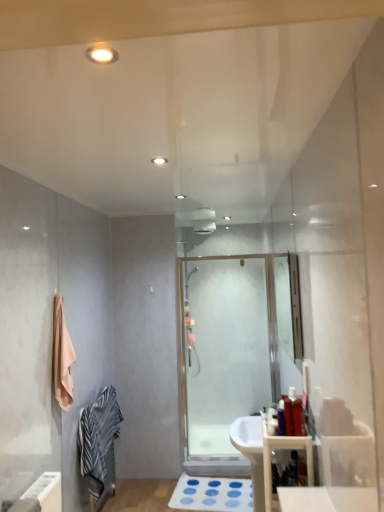
Question: Considering the relative sizes of matte plastic toothbrush at center, arranged as the first toiletry when viewed from the left, and transparent glass shower door at center in the image provided, is matte plastic toothbrush at center, arranged as the first toiletry when viewed from the left, smaller than transparent glass shower door at center?

Choices:
 (A) yes
 (B) no

Answer: (A)

Question: Is transparent glass shower door at center surrounded by matte plastic toothbrush at center, the second toiletry in the right-to-left sequence?

Choices:
 (A) no
 (B) yes

Answer: (A)

Question: Is matte plastic toothbrush at center, arranged as the first toiletry when viewed from the left, placed right next to transparent glass shower door at center?

Choices:
 (A) yes
 (B) no

Answer: (B)

Question: Can we say matte plastic toothbrush at center, arranged as the first toiletry when viewed from the left, lies outside transparent glass shower door at center?

Choices:
 (A) yes
 (B) no

Answer: (A)

Question: Considering the relative positions of matte plastic toothbrush at center, the second toiletry in the right-to-left sequence, and transparent glass shower door at center in the image provided, is matte plastic toothbrush at center, the second toiletry in the right-to-left sequence, behind transparent glass shower door at center?

Choices:
 (A) no
 (B) yes

Answer: (A)

Question: From the image's perspective, relative to wooden storage at lower right, is clear glass mirror at center above or below?

Choices:
 (A) above
 (B) below

Answer: (A)

Question: Considering their positions, is clear glass mirror at center located in front of or behind wooden storage at lower right?

Choices:
 (A) front
 (B) behind

Answer: (B)

Question: Visually, is clear glass mirror at center positioned to the left or to the right of wooden storage at lower right?

Choices:
 (A) right
 (B) left

Answer: (A)

Question: Considering the positions of clear glass mirror at center and wooden storage at lower right in the image, is clear glass mirror at center bigger or smaller than wooden storage at lower right?

Choices:
 (A) big
 (B) small

Answer: (B)

Question: Is matte plastic toothbrush at center, the second toiletry in the right-to-left sequence, taller or shorter than white rubber bath mat at lower center?

Choices:
 (A) tall
 (B) short

Answer: (A)

Question: Is matte plastic toothbrush at center, arranged as the first toiletry when viewed from the left, wider or thinner than white rubber bath mat at lower center?

Choices:
 (A) thin
 (B) wide

Answer: (A)

Question: Considering the positions of point (268, 431) and point (200, 480), is point (268, 431) closer or farther from the camera than point (200, 480)?

Choices:
 (A) farther
 (B) closer

Answer: (B)

Question: Considering their positions, is matte plastic toothbrush at center, the second toiletry in the right-to-left sequence, located in front of or behind white rubber bath mat at lower center?

Choices:
 (A) behind
 (B) front

Answer: (B)

Question: Looking at the image, does clear glass mirror at center seem bigger or smaller compared to striped cotton bathrobe at lower left?

Choices:
 (A) small
 (B) big

Answer: (A)

Question: Is clear glass mirror at center inside or outside of striped cotton bathrobe at lower left?

Choices:
 (A) outside
 (B) inside

Answer: (A)